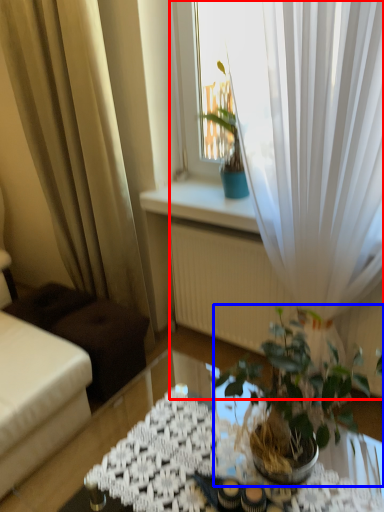
Question: Which of the following is the closest to the observer, curtain (highlighted by a red box) or houseplant (highlighted by a blue box)?

Choices:
 (A) curtain
 (B) houseplant

Answer: (B)